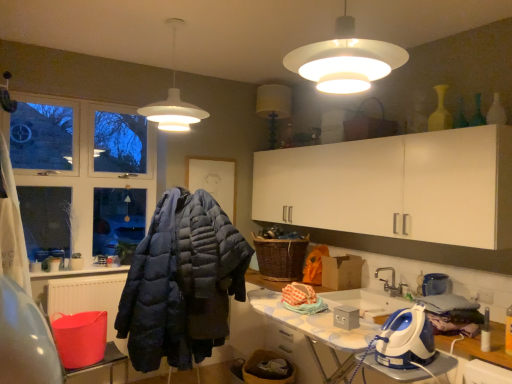
Question: From their relative heights in the image, would you say white matte pendant light at upper center, the 2th lamp from the right, is taller or shorter than silver metallic faucet at lower center?

Choices:
 (A) short
 (B) tall

Answer: (B)

Question: In terms of size, does white matte pendant light at upper center, which is counted as the 1th lamp, starting from the left, appear bigger or smaller than silver metallic faucet at lower center?

Choices:
 (A) small
 (B) big

Answer: (B)

Question: Which is nearer to the woven brown laundry basket at center?

Choices:
 (A) silver metallic faucet at lower center
 (B) white matte lampshade at upper center, arranged as the first lamp when viewed from the front
 (C) dark blue quilted jacket at center
 (D) blue plastic iron at lower right
 (E) white matte pendant light at upper center, the first lamp when ordered from back to front

Answer: (A)

Question: Considering the real-world distances, which object is farthest from the woven brown laundry basket at center?

Choices:
 (A) white matte lampshade at upper center, which is the 2th lamp from left to right
 (B) silver metallic faucet at lower center
 (C) white matte pendant light at upper center, the first lamp when ordered from back to front
 (D) white glossy ironing board at lower right
 (E) blue plastic iron at lower right

Answer: (A)